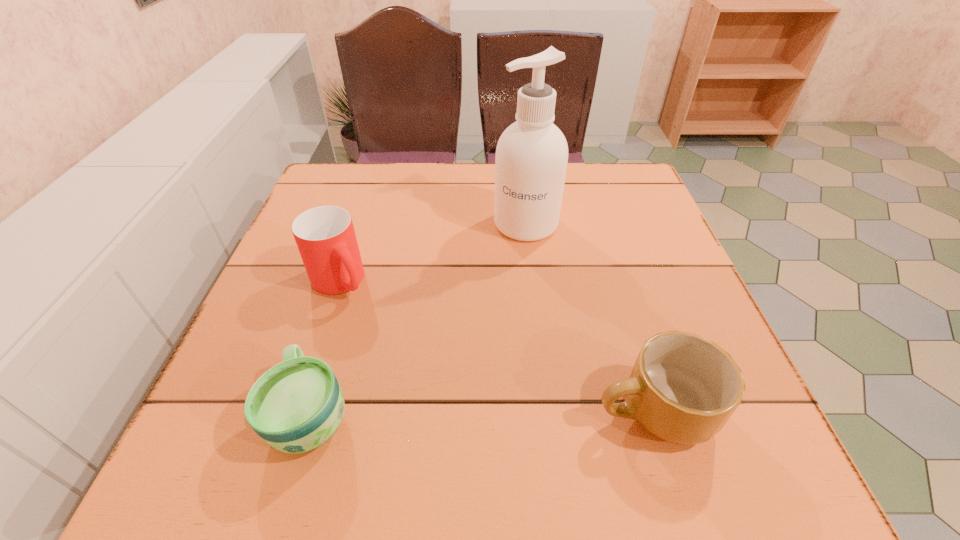
You are a GUI agent. You are given a task and a screenshot of the screen. Output one action in this format:
    pyautogui.click(x=<x>, y=<y>)
    Task: Click on the vacant region located on the front label of the farthest object
    The height and width of the screenshot is (540, 960).
    Given the screenshot: What is the action you would take?
    pyautogui.click(x=493, y=336)

The width and height of the screenshot is (960, 540). In order to click on vacant space positioned 0.090m on the front label of the farthest object in this screenshot , I will do `click(513, 269)`.

The width and height of the screenshot is (960, 540). Find the location of `vacant space positioned on the front label of the farthest object`. vacant space positioned on the front label of the farthest object is located at coordinates (497, 321).

Identify the location of free space located 0.310m on the side of the farther cup with the handle. (444, 404).

At what (x,y) coordinates should I click in order to perform the action: click on vacant space located on the side of the farther cup with the handle. Please return your answer as a coordinate pair (x, y). This screenshot has height=540, width=960. Looking at the image, I should click on 420,376.

This screenshot has height=540, width=960. Find the location of `free spot located 0.190m on the side of the farther cup with the handle`. free spot located 0.190m on the side of the farther cup with the handle is located at coordinates (404, 358).

Find the location of a particular element. object that is at the far edge is located at coordinates (531, 159).

Locate an element on the screen. cup situated at the near edge is located at coordinates (296, 406).

Locate an element on the screen. mug at the near edge is located at coordinates (683, 388).

Locate an element on the screen. The height and width of the screenshot is (540, 960). object located at the right edge is located at coordinates (683, 388).